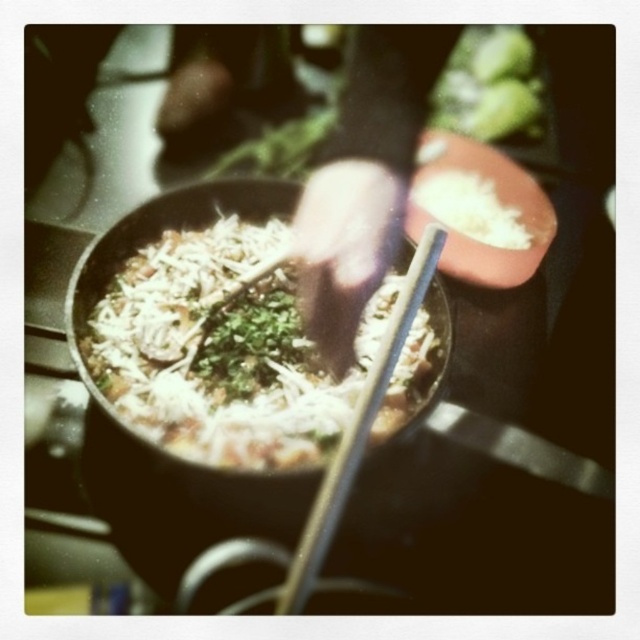
Question: Based on their relative distances, which object is farther from the wooden chopsticks at center?

Choices:
 (A) white shredded cheese at center
 (B) white fluffy rice at center

Answer: (B)

Question: Can you confirm if wooden chopsticks at center is thinner than green leafy vegetable at upper center?

Choices:
 (A) yes
 (B) no

Answer: (A)

Question: Which of the following is the farthest from the observer?

Choices:
 (A) (177, 403)
 (B) (388, 372)
 (C) (416, 202)
 (D) (515, 93)

Answer: (D)

Question: Can you confirm if white shredded cheese at center is positioned above white fluffy rice at center?

Choices:
 (A) yes
 (B) no

Answer: (B)

Question: Is wooden chopsticks at center closer to the viewer compared to white fluffy rice at center?

Choices:
 (A) yes
 (B) no

Answer: (A)

Question: Which of these objects is positioned farthest from the white shredded cheese at center?

Choices:
 (A) green leafy vegetable at upper center
 (B) wooden chopsticks at center
 (C) white fluffy rice at center

Answer: (A)